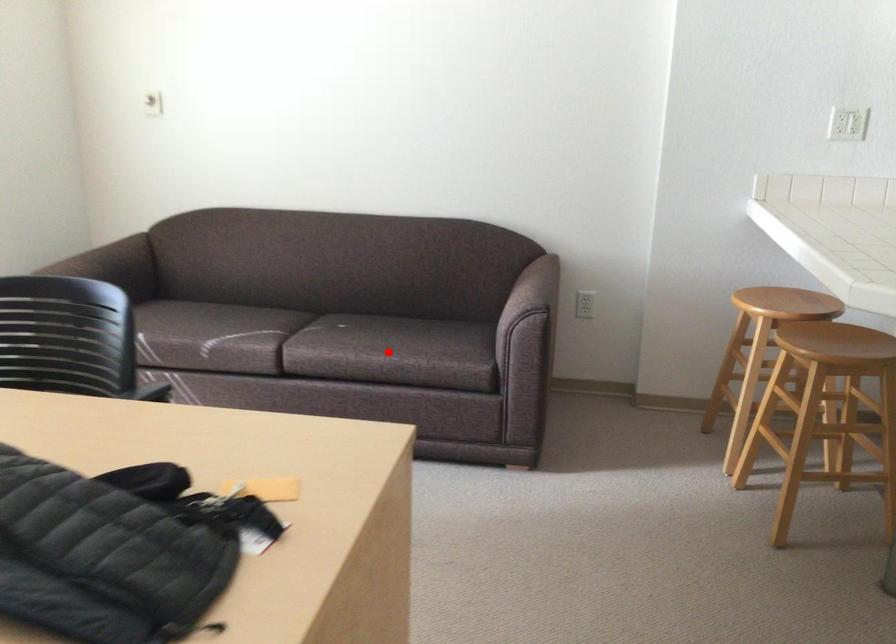
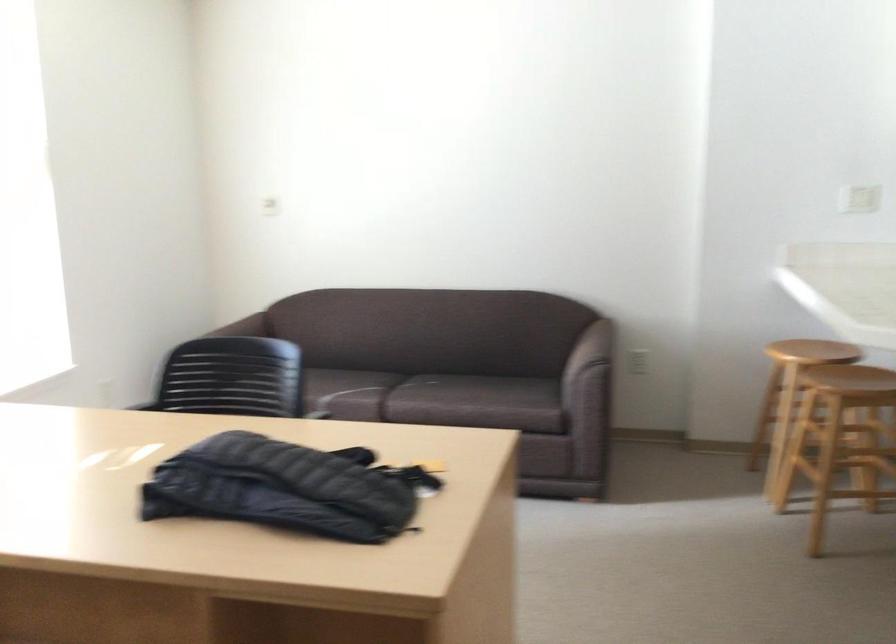
In the second image, find the point that corresponds to the highlighted location in the first image.

(475, 401)